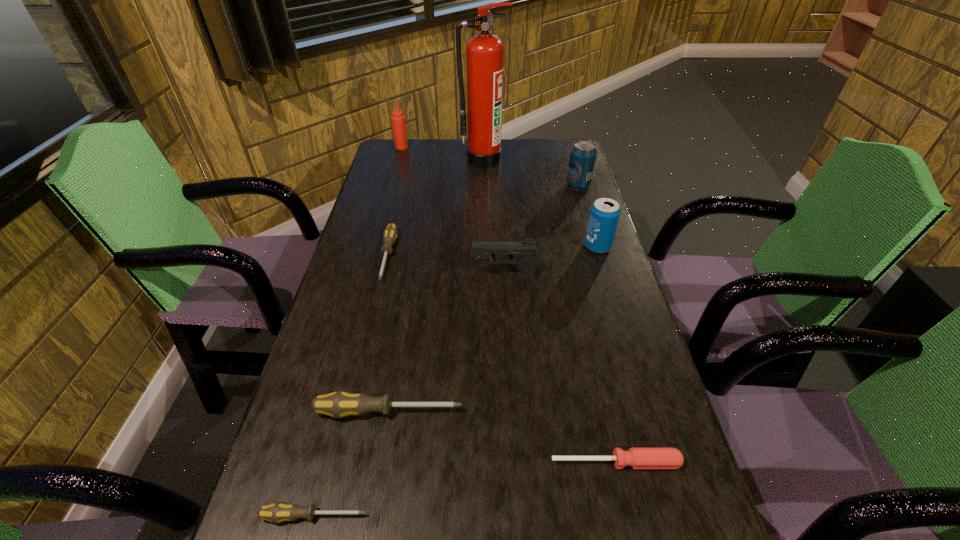
Image resolution: width=960 pixels, height=540 pixels. In order to click on the tallest object in this screenshot , I will do `click(484, 52)`.

At what (x,y) coordinates should I click in order to perform the action: click on the second farthest object. Please return your answer as a coordinate pair (x, y). Looking at the image, I should click on (484, 52).

You are a GUI agent. You are given a task and a screenshot of the screen. Output one action in this format:
    pyautogui.click(x=<x>, y=<y>)
    Task: Click on the farthest object
    Image resolution: width=960 pixels, height=540 pixels.
    Given the screenshot: What is the action you would take?
    pyautogui.click(x=398, y=119)

What are the coordinates of `the third farthest object` in the screenshot? It's located at (583, 154).

Where is `the nearer soda can`? The image size is (960, 540). the nearer soda can is located at coordinates (604, 215).

Where is `pistol`? Image resolution: width=960 pixels, height=540 pixels. pistol is located at coordinates (519, 252).

At what (x,y) coordinates should I click in order to perform the action: click on the third nearest object. Please return your answer as a coordinate pair (x, y). This screenshot has height=540, width=960. Looking at the image, I should click on (339, 404).

This screenshot has height=540, width=960. Identify the location of the second farthest screwdriver. (339, 404).

The image size is (960, 540). What are the coordinates of `the third shortest object` in the screenshot? It's located at (390, 233).

Locate an element on the screen. This screenshot has height=540, width=960. the second biggest gray screwdriver is located at coordinates (390, 233).